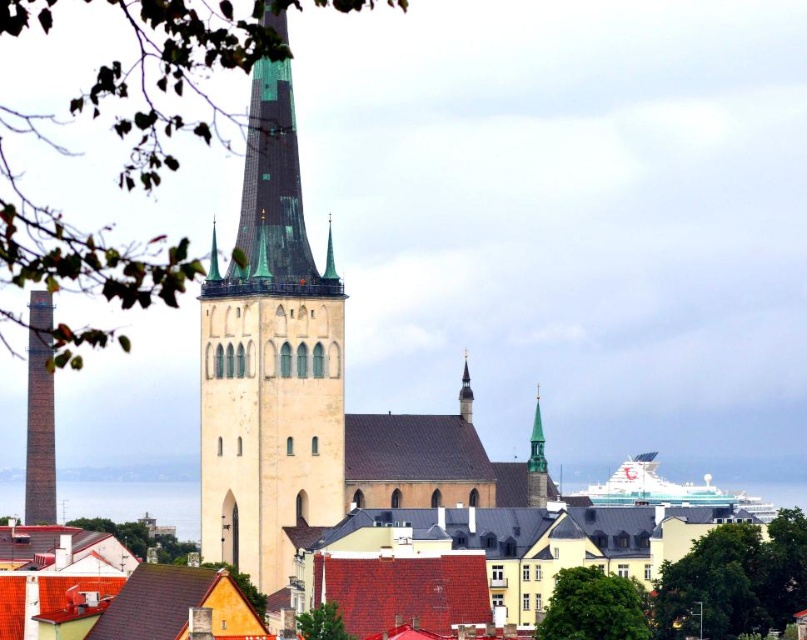
Does beige stone tower at center have a greater width compared to transparent glass water at lower left?

Incorrect, beige stone tower at center's width does not surpass transparent glass water at lower left's.

Which is more to the left, beige stone tower at center or transparent glass water at lower left?

From the viewer's perspective, transparent glass water at lower left appears more on the left side.

Does point (289, 358) come closer to viewer compared to point (57, 506)?

That is True.

Where is `beige stone tower at center`? This screenshot has height=640, width=807. beige stone tower at center is located at coordinates point(270,362).

Who is taller, brick chimney at left or gold textured spire at center?

Standing taller between the two is brick chimney at left.

Is brick chimney at left above gold textured spire at center?

No, brick chimney at left is not above gold textured spire at center.

This screenshot has width=807, height=640. What do you see at coordinates (40, 413) in the screenshot?
I see `brick chimney at left` at bounding box center [40, 413].

I want to click on brick chimney at left, so click(40, 413).

Can you confirm if beige stone tower at center is positioned above green spire at center?

No, beige stone tower at center is not above green spire at center.

Between beige stone tower at center and green spire at center, which one appears on the right side from the viewer's perspective?

beige stone tower at center

Does point (274, 116) come closer to viewer compared to point (214, 237)?

Yes, point (274, 116) is in front of point (214, 237).

Find the location of a particular element. The height and width of the screenshot is (640, 807). beige stone tower at center is located at coordinates (270, 362).